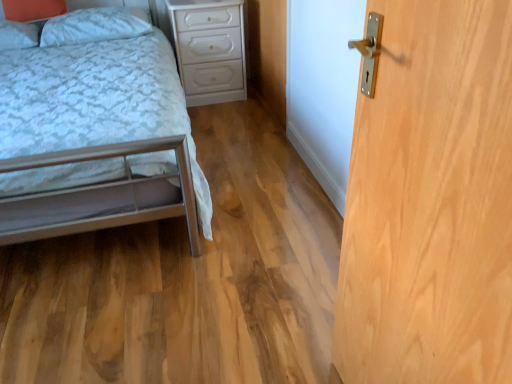
Question: From a real-world perspective, is light wood/texture door at right over white glossy nightstand at center?

Choices:
 (A) no
 (B) yes

Answer: (B)

Question: Is the depth of light wood/texture door at right greater than that of white glossy nightstand at center?

Choices:
 (A) yes
 (B) no

Answer: (B)

Question: Is light wood/texture door at right to the right of white glossy nightstand at center from the viewer's perspective?

Choices:
 (A) yes
 (B) no

Answer: (A)

Question: Can you confirm if light wood/texture door at right is bigger than white glossy nightstand at center?

Choices:
 (A) yes
 (B) no

Answer: (B)

Question: Considering the relative sizes of light wood/texture door at right and white glossy nightstand at center in the image provided, is light wood/texture door at right smaller than white glossy nightstand at center?

Choices:
 (A) no
 (B) yes

Answer: (B)

Question: Would you say white glossy nightstand at center is part of light wood/texture door at right's contents?

Choices:
 (A) yes
 (B) no

Answer: (B)

Question: Considering the relative positions of white glossy nightstand at center and matte white pillow at upper left, arranged as the second pillow when viewed from the right, in the image provided, is white glossy nightstand at center to the right of matte white pillow at upper left, arranged as the second pillow when viewed from the right, from the viewer's perspective?

Choices:
 (A) yes
 (B) no

Answer: (A)

Question: From the image's perspective, is white glossy nightstand at center on matte white pillow at upper left, placed as the 1th pillow when sorted from left to right?

Choices:
 (A) yes
 (B) no

Answer: (A)

Question: Does white glossy nightstand at center come in front of matte white pillow at upper left, placed as the 1th pillow when sorted from left to right?

Choices:
 (A) yes
 (B) no

Answer: (B)

Question: Considering the relative sizes of white glossy nightstand at center and matte white pillow at upper left, placed as the 1th pillow when sorted from left to right, in the image provided, is white glossy nightstand at center bigger than matte white pillow at upper left, placed as the 1th pillow when sorted from left to right,?

Choices:
 (A) yes
 (B) no

Answer: (A)

Question: Is white glossy nightstand at center wider than matte white pillow at upper left, arranged as the second pillow when viewed from the right?

Choices:
 (A) yes
 (B) no

Answer: (A)

Question: Is matte white pillow at upper left, placed as the 1th pillow when sorted from left to right, a part of white glossy nightstand at center?

Choices:
 (A) no
 (B) yes

Answer: (A)

Question: Is white glossy nightstand at center bigger than white soft pillow at upper left, which is the 1th pillow from right to left?

Choices:
 (A) no
 (B) yes

Answer: (B)